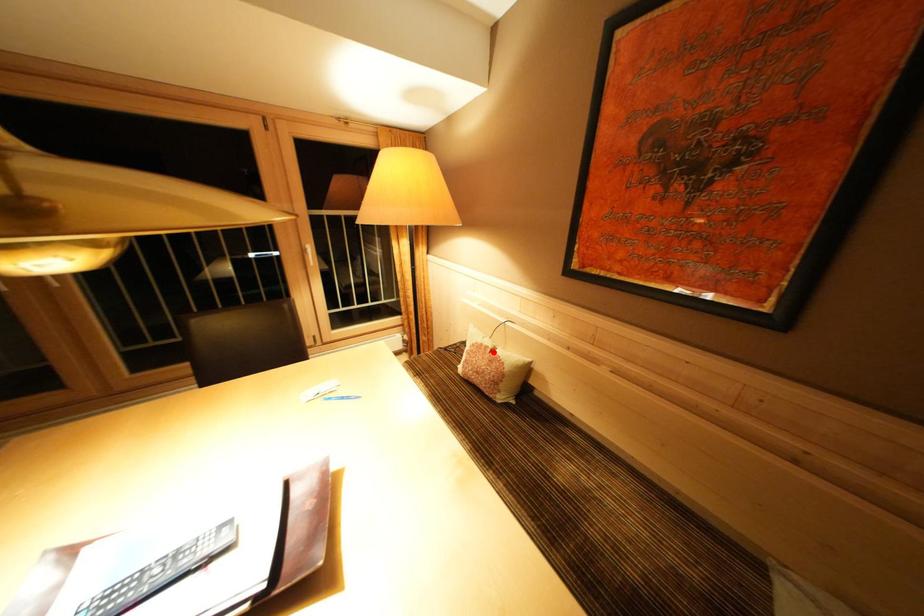
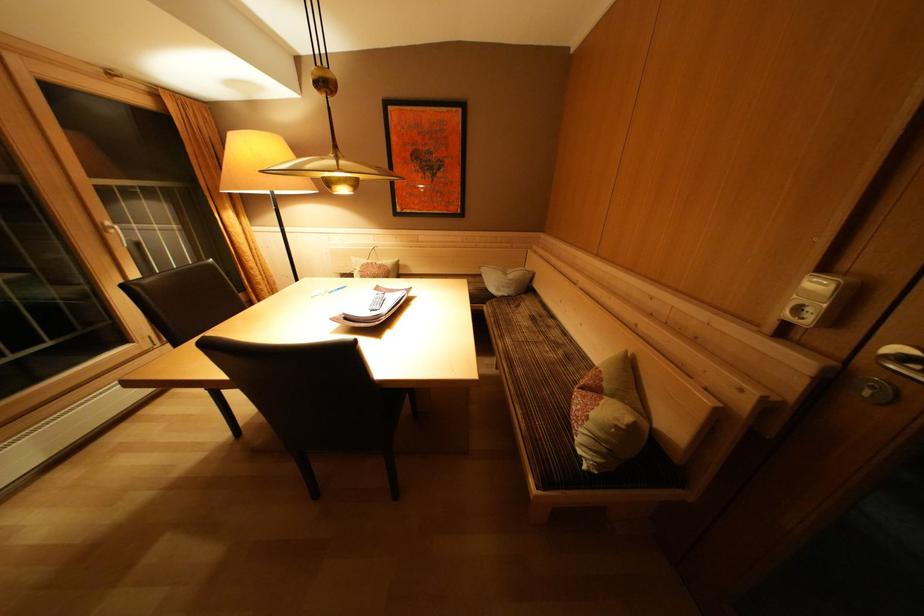
In the second image, find the point that corresponds to the highlighted location in the first image.

(379, 268)